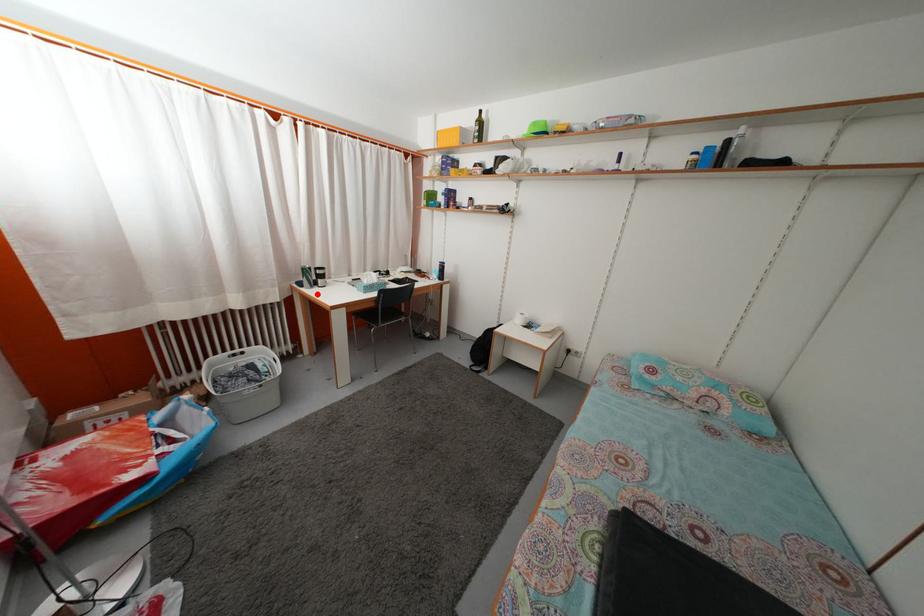
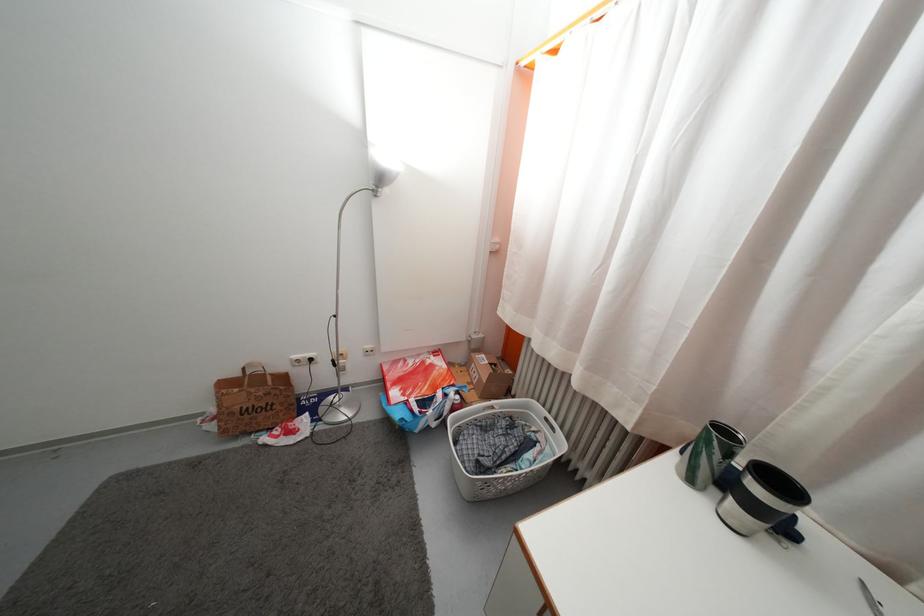
Locate, in the second image, the point that corresponds to the highlighted location in the first image.

(697, 488)